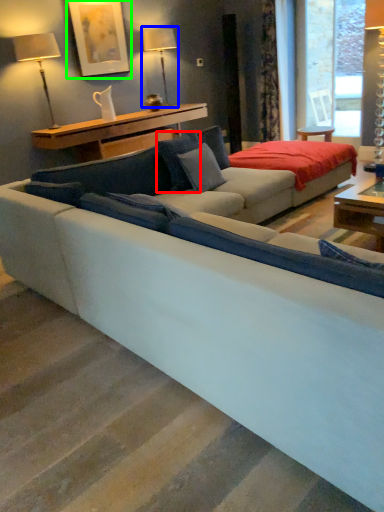
Question: Based on their relative distances, which object is farther from pillow (highlighted by a red box)? Choose from table lamp (highlighted by a blue box) and picture frame (highlighted by a green box).

Choices:
 (A) table lamp
 (B) picture frame

Answer: (A)